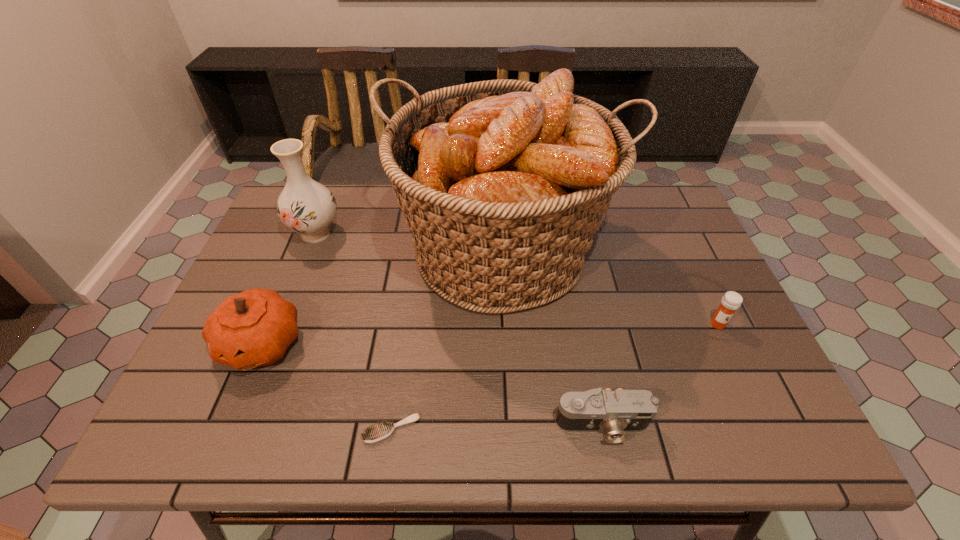
This screenshot has height=540, width=960. What are the coordinates of `blank area at the left edge` in the screenshot? It's located at (248, 376).

Locate an element on the screen. vacant space at the right edge is located at coordinates (663, 269).

The height and width of the screenshot is (540, 960). Identify the location of free space at the near left corner of the desktop. (220, 429).

In the image, there is a desktop. Where is `blank space at the far right corner`? blank space at the far right corner is located at coordinates (648, 208).

Find the location of a particular element. Image resolution: width=960 pixels, height=540 pixels. free area in between the third tallest object and the vase is located at coordinates (289, 288).

Where is `vacant area between the third tallest object and the rightmost object`? Image resolution: width=960 pixels, height=540 pixels. vacant area between the third tallest object and the rightmost object is located at coordinates (490, 334).

Find the location of a particular element. The height and width of the screenshot is (540, 960). blank region between the basket and the scrubbing brush is located at coordinates (447, 340).

Image resolution: width=960 pixels, height=540 pixels. In order to click on vacant space that's between the camera and the tallest object in this screenshot , I will do `click(553, 339)`.

Identify the location of unoccupied position between the fourth shortest object and the rightmost object. (490, 334).

You are a GUI agent. You are given a task and a screenshot of the screen. Output one action in this format:
    pyautogui.click(x=<x>, y=<y>)
    Task: Click on the free space between the second tallest object and the tallest object
    This screenshot has height=540, width=960.
    Given the screenshot: What is the action you would take?
    pyautogui.click(x=409, y=242)